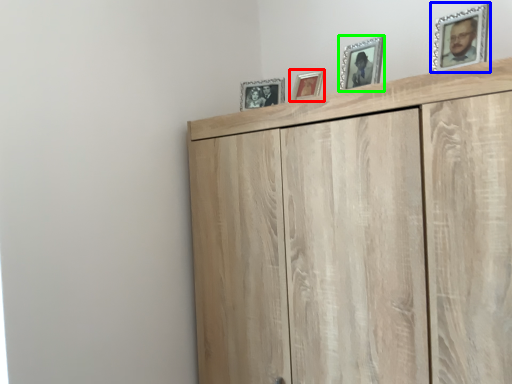
Question: Estimate the real-world distances between objects in this image. Which object is closer to picture frame (highlighted by a red box), picture frame (highlighted by a blue box) or picture frame (highlighted by a green box)?

Choices:
 (A) picture frame
 (B) picture frame

Answer: (B)